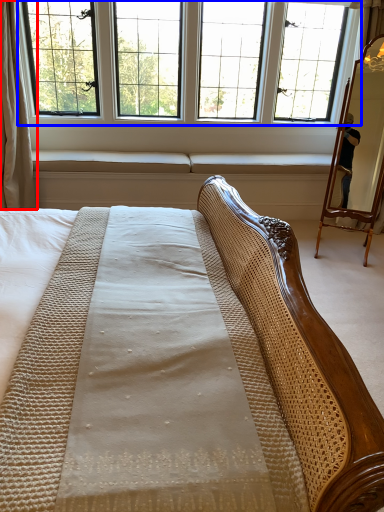
Question: Which of the following is the closest to the observer, curtain (highlighted by a red box) or window (highlighted by a blue box)?

Choices:
 (A) curtain
 (B) window

Answer: (A)